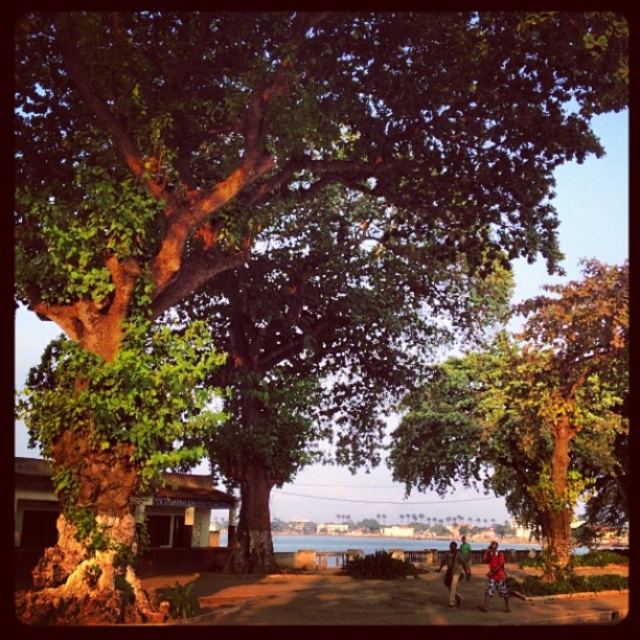
You are standing at the center of the image and want to locate the red fabric person at lower right. Based on the coordinates provided, in which direction should you turn to face them?

The red fabric person at lower right is located at coordinates approximately 0.902 on the x and 0.773 on the y axis. Since the x value is closer to 1, they are positioned to the right side of the image. To face them from the center, you should turn to your right.

You are standing in the outdoor scene and want to walk towards both the point at coordinates (504, 358) and the point at coordinates (465, 550). Which point will you reach first?

You will reach point (504, 358) first because it is closer to you than point (465, 550), which is further away.

You are standing at the origin point in the image and want to walk towards the two points marked as point (579, 488) and point (454, 554). Which point will you encounter first?

Point (454, 554) will be encountered first because it is closer to the origin compared to point (579, 488), which is further away.